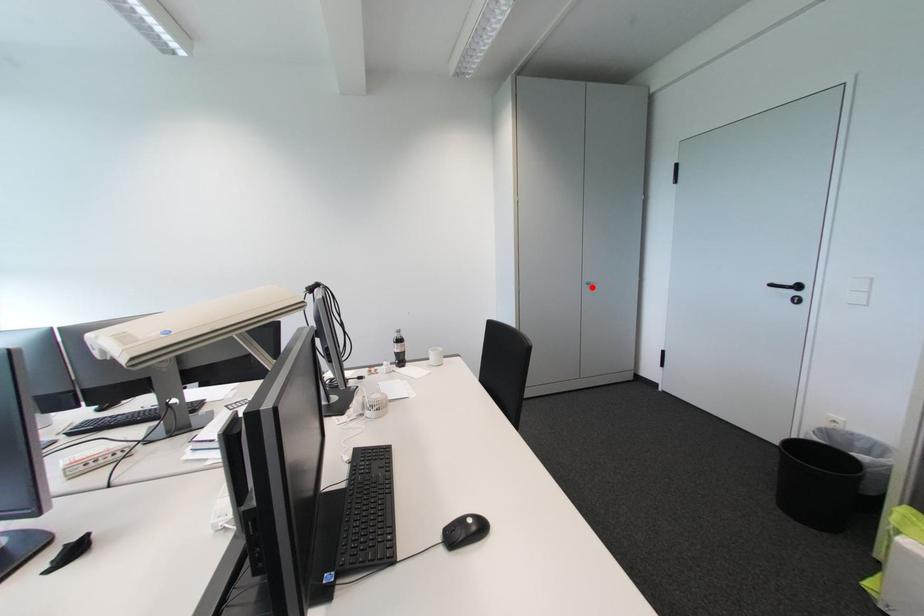
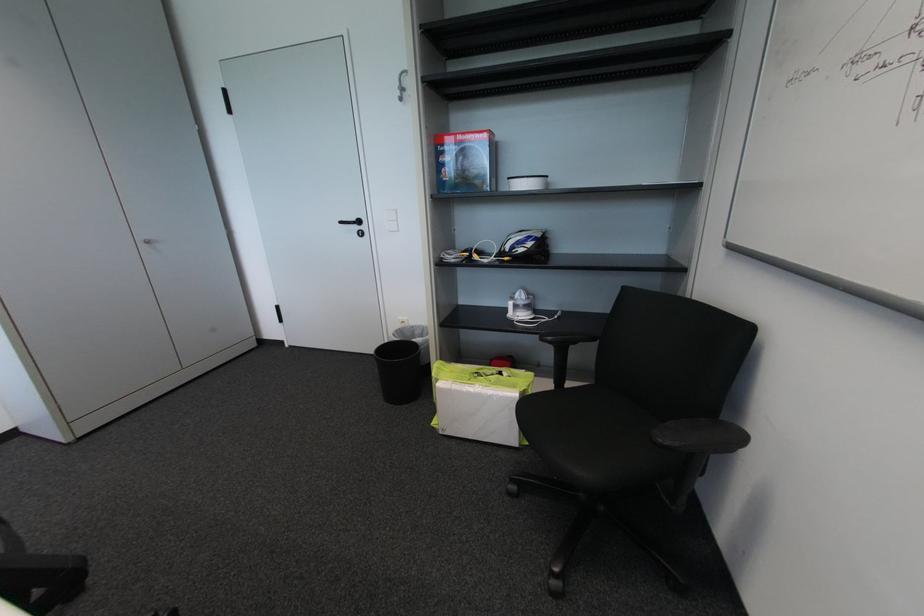
In the second image, find the point that corresponds to the highlighted location in the first image.

(151, 246)